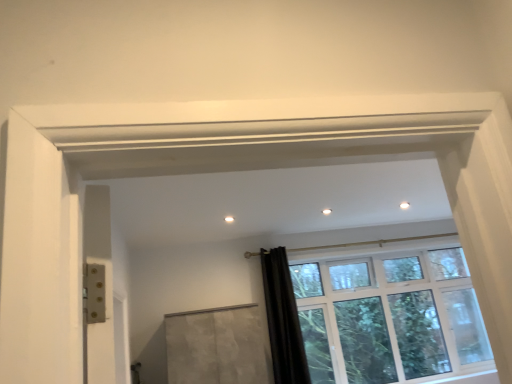
Question: From a real-world perspective, is matte concrete screen door at center physically located above or below clear glass window at center?

Choices:
 (A) above
 (B) below

Answer: (B)

Question: Is matte concrete screen door at center inside the boundaries of clear glass window at center, or outside?

Choices:
 (A) inside
 (B) outside

Answer: (B)

Question: Estimate the real-world distances between objects in this image. Which object is closer to the black velvet curtain at lower right?

Choices:
 (A) clear glass window at center
 (B) matte concrete screen door at center

Answer: (B)

Question: Which is farther from the clear glass window at center?

Choices:
 (A) black velvet curtain at lower right
 (B) matte concrete screen door at center

Answer: (B)